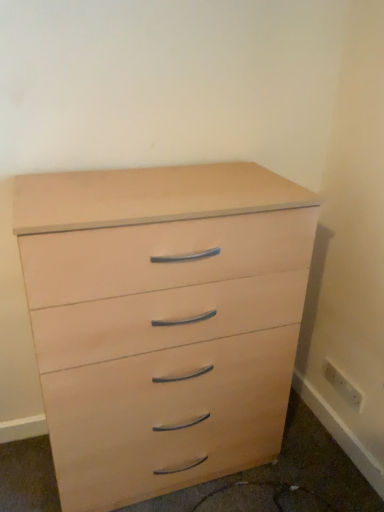
Question: Considering the relative sizes of light wood drawer at lower right and white plastic electric outlet at lower right in the image provided, is light wood drawer at lower right bigger than white plastic electric outlet at lower right?

Choices:
 (A) no
 (B) yes

Answer: (B)

Question: Is light wood drawer at lower right positioned with its back to white plastic electric outlet at lower right?

Choices:
 (A) yes
 (B) no

Answer: (B)

Question: Is light wood drawer at lower right outside white plastic electric outlet at lower right?

Choices:
 (A) yes
 (B) no

Answer: (A)

Question: Is light wood drawer at lower right next to white plastic electric outlet at lower right?

Choices:
 (A) no
 (B) yes

Answer: (A)

Question: Is light wood drawer at lower right further to the viewer compared to white plastic electric outlet at lower right?

Choices:
 (A) no
 (B) yes

Answer: (A)

Question: Looking at their shapes, would you say light wood drawer at lower right is wider or thinner than light wood/veneer chest of drawers at center?

Choices:
 (A) wide
 (B) thin

Answer: (A)

Question: From a real-world perspective, relative to light wood/veneer chest of drawers at center, is light wood drawer at lower right vertically above or below?

Choices:
 (A) above
 (B) below

Answer: (B)

Question: Do you think light wood drawer at lower right is within light wood/veneer chest of drawers at center, or outside of it?

Choices:
 (A) inside
 (B) outside

Answer: (B)

Question: In the image, is light wood drawer at lower right positioned in front of or behind light wood/veneer chest of drawers at center?

Choices:
 (A) front
 (B) behind

Answer: (B)

Question: Considering their positions, is light wood drawer at lower right located in front of or behind white plastic electric outlet at lower right?

Choices:
 (A) behind
 (B) front

Answer: (B)

Question: Would you say light wood drawer at lower right is inside or outside white plastic electric outlet at lower right?

Choices:
 (A) outside
 (B) inside

Answer: (A)

Question: Is point (165, 415) closer or farther from the camera than point (357, 402)?

Choices:
 (A) farther
 (B) closer

Answer: (B)

Question: Would you say light wood drawer at lower right is to the left or to the right of white plastic electric outlet at lower right in the picture?

Choices:
 (A) right
 (B) left

Answer: (B)

Question: Visually, is white plastic electric outlet at lower right positioned to the left or to the right of light wood drawer at lower right?

Choices:
 (A) right
 (B) left

Answer: (A)

Question: Looking at their shapes, would you say white plastic electric outlet at lower right is wider or thinner than light wood drawer at lower right?

Choices:
 (A) thin
 (B) wide

Answer: (A)